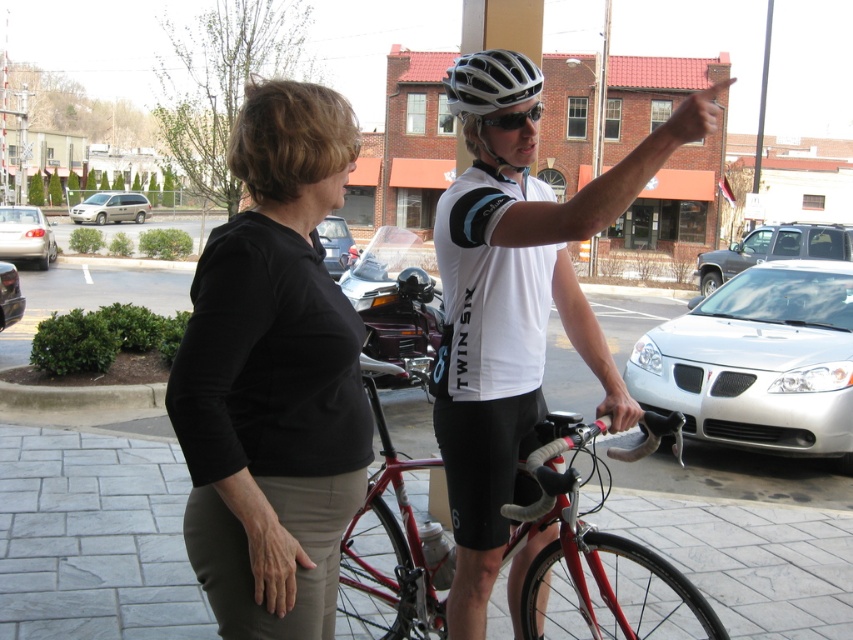
Question: Estimate the real-world distances between objects in this image. Which object is closer to the silver metallic suv at right?

Choices:
 (A) beige matte minivan at left
 (B) black matte sunglasses at upper center
 (C) silver metallic sedan at lower right

Answer: (C)

Question: Can you confirm if shiny red bicycle at center is positioned to the left of silver/glossy bicycle helmet at upper center?

Choices:
 (A) no
 (B) yes

Answer: (B)

Question: Which point is farther from the camera taking this photo?

Choices:
 (A) [x=357, y=298]
 (B) [x=477, y=163]
 (C) [x=328, y=241]

Answer: (C)

Question: Is silver/glossy bicycle helmet at upper center bigger than beige matte minivan at left?

Choices:
 (A) yes
 (B) no

Answer: (A)

Question: Is black fabric shirt at center in front of silver metallic suv at right?

Choices:
 (A) yes
 (B) no

Answer: (A)

Question: Among these points, which one is nearest to the camera?

Choices:
 (A) (10, 280)
 (B) (260, 474)
 (C) (412, 321)
 (D) (318, 228)

Answer: (B)